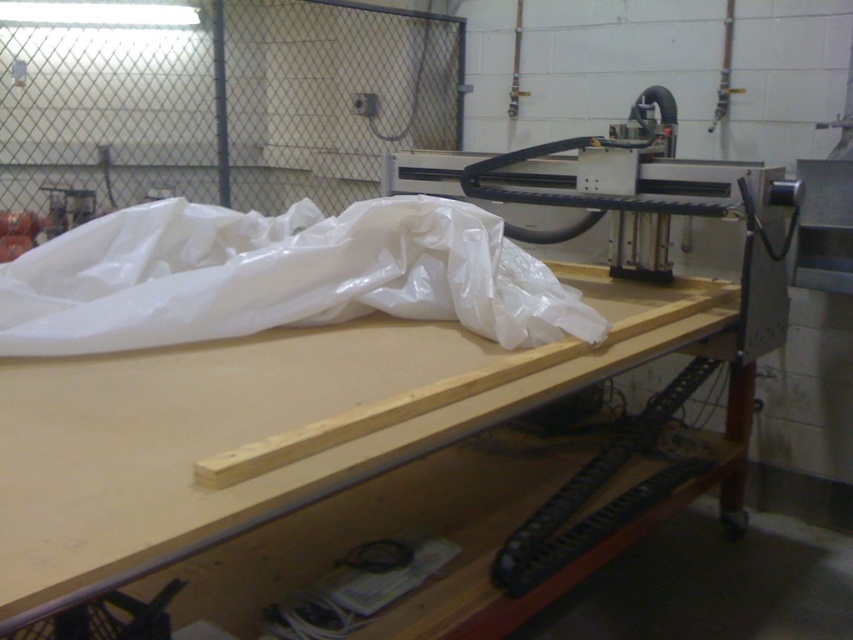
Looking at this image, you are organizing materials in a workshop. You have a light brown wood at center and a white plastic bag at center on the workbench. Which object is wider?

The light brown wood at center is wider than the white plastic bag at center.

You are a carpenter trying to place a 1.2 meter wide wooden board on the workbench. The workbench has the light brown wood at center and the black plastic track at lower center. Which part of the workbench can accommodate the board in terms of width?

The light brown wood at center might be wider than the black plastic track at lower center, so it is more likely to accommodate the 1.2 meter wide wooden board in terms of width.